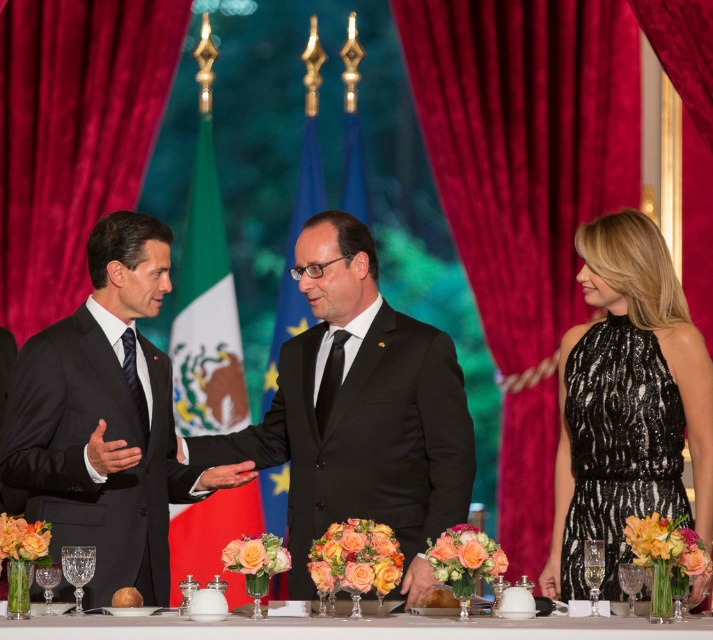
Question: Does velvet curtain at center have a lesser width compared to white ceramic table at center?

Choices:
 (A) yes
 (B) no

Answer: (A)

Question: Which point is farther to the camera?

Choices:
 (A) black sequined dress at right
 (B) black satin suit at left

Answer: (A)

Question: Can you confirm if black satin suit at left is smaller than black sequined dress at right?

Choices:
 (A) yes
 (B) no

Answer: (B)

Question: Estimate the real-world distances between objects in this image. Which object is closer to the white ceramic table at center?

Choices:
 (A) black satin suit at left
 (B) velvet curtain at center
 (C) black sequined dress at right
 (D) velvet red curtain at left

Answer: (C)

Question: Does velvet curtain at center appear on the left side of black satin suit at left?

Choices:
 (A) yes
 (B) no

Answer: (B)

Question: Based on their relative distances, which object is nearer to the black satin suit at left?

Choices:
 (A) velvet curtain at center
 (B) white ceramic table at center
 (C) velvet red curtain at left

Answer: (B)